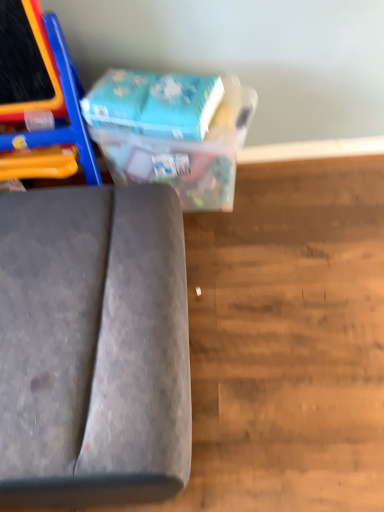
Question: Is blue cardboard box at upper center taller than blue cardboard box at upper center?

Choices:
 (A) no
 (B) yes

Answer: (A)

Question: Is the depth of blue cardboard box at upper center greater than that of blue cardboard box at upper center?

Choices:
 (A) yes
 (B) no

Answer: (B)

Question: From the image's perspective, would you say blue cardboard box at upper center is shown under blue cardboard box at upper center?

Choices:
 (A) yes
 (B) no

Answer: (B)

Question: Would you say blue cardboard box at upper center is outside blue cardboard box at upper center?

Choices:
 (A) yes
 (B) no

Answer: (A)

Question: Does blue cardboard box at upper center touch blue cardboard box at upper center?

Choices:
 (A) yes
 (B) no

Answer: (A)

Question: Looking at the image, does blue cardboard box at upper center seem bigger or smaller compared to velvet grey sofa at lower left?

Choices:
 (A) small
 (B) big

Answer: (A)

Question: Relative to velvet grey sofa at lower left, is blue cardboard box at upper center in front or behind?

Choices:
 (A) front
 (B) behind

Answer: (B)

Question: Considering the positions of blue cardboard box at upper center and velvet grey sofa at lower left in the image, is blue cardboard box at upper center taller or shorter than velvet grey sofa at lower left?

Choices:
 (A) short
 (B) tall

Answer: (A)

Question: Is blue cardboard box at upper center inside the boundaries of velvet grey sofa at lower left, or outside?

Choices:
 (A) outside
 (B) inside

Answer: (A)

Question: Based on their sizes in the image, would you say blue cardboard box at upper center is bigger or smaller than blue cardboard box at upper center?

Choices:
 (A) small
 (B) big

Answer: (B)

Question: Which is correct: blue cardboard box at upper center is inside blue cardboard box at upper center, or outside of it?

Choices:
 (A) inside
 (B) outside

Answer: (B)

Question: From a real-world perspective, is blue cardboard box at upper center above or below blue cardboard box at upper center?

Choices:
 (A) below
 (B) above

Answer: (A)

Question: Considering the positions of blue cardboard box at upper center and blue cardboard box at upper center in the image, is blue cardboard box at upper center wider or thinner than blue cardboard box at upper center?

Choices:
 (A) thin
 (B) wide

Answer: (B)

Question: Relative to blue cardboard box at upper center, is blue cardboard box at upper center in front or behind?

Choices:
 (A) front
 (B) behind

Answer: (A)

Question: From their relative heights in the image, would you say blue cardboard box at upper center is taller or shorter than blue cardboard box at upper center?

Choices:
 (A) tall
 (B) short

Answer: (B)